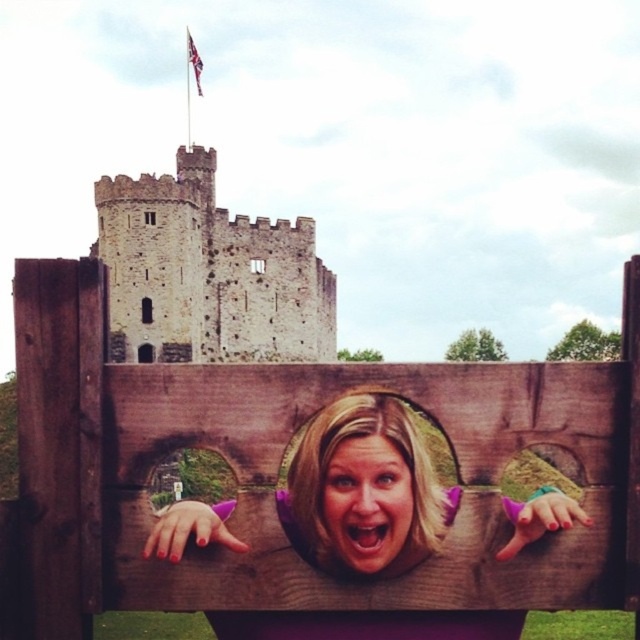
Is smooth blonde hair at center further to camera compared to smooth skin face at center?

No, it is not.

Where is `smooth blonde hair at center`? The image size is (640, 640). smooth blonde hair at center is located at coordinates (364, 490).

Does stone medieval tower at upper left have a lesser width compared to smooth blonde hair at center?

No, stone medieval tower at upper left is not thinner than smooth blonde hair at center.

Is point (288, 227) positioned after point (342, 488)?

That is True.

What are the coordinates of `stone medieval tower at upper left` in the screenshot? It's located at (208, 273).

Can you confirm if stone medieval tower at upper left is smaller than smooth skin face at center?

Incorrect, stone medieval tower at upper left is not smaller in size than smooth skin face at center.

Does stone medieval tower at upper left have a lesser width compared to smooth skin face at center?

No.

Which is behind, point (112, 326) or point (349, 554)?

Positioned behind is point (112, 326).

Locate an element on the screen. stone medieval tower at upper left is located at coordinates (208, 273).